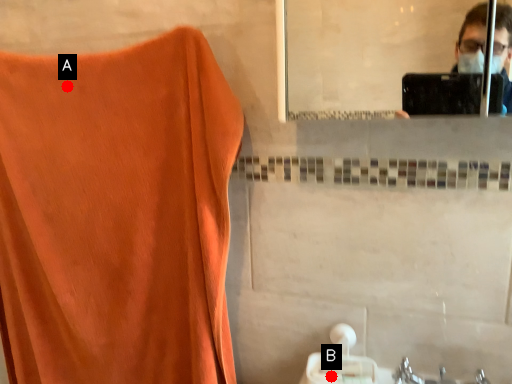
Question: Two points are circled on the image, labeled by A and B beside each circle. Which of the following is the farthest from the observer?

Choices:
 (A) A is further
 (B) B is further

Answer: (A)